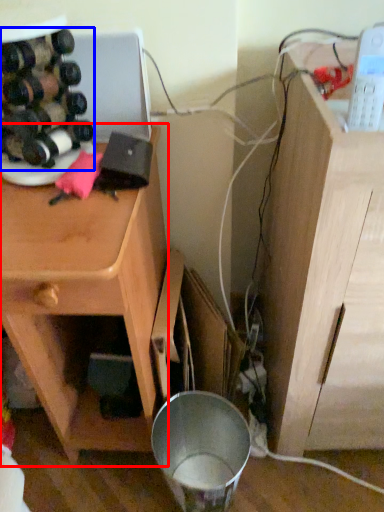
Question: Which point is closer to the camera, cabinetry (highlighted by a red box) or wine bottle (highlighted by a blue box)?

Choices:
 (A) cabinetry
 (B) wine bottle

Answer: (A)